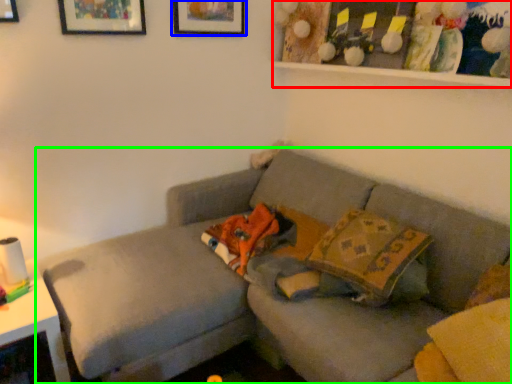
Question: Which is farther away from shelf (highlighted by a red box)? picture frame (highlighted by a blue box) or studio couch (highlighted by a green box)?

Choices:
 (A) picture frame
 (B) studio couch

Answer: (B)